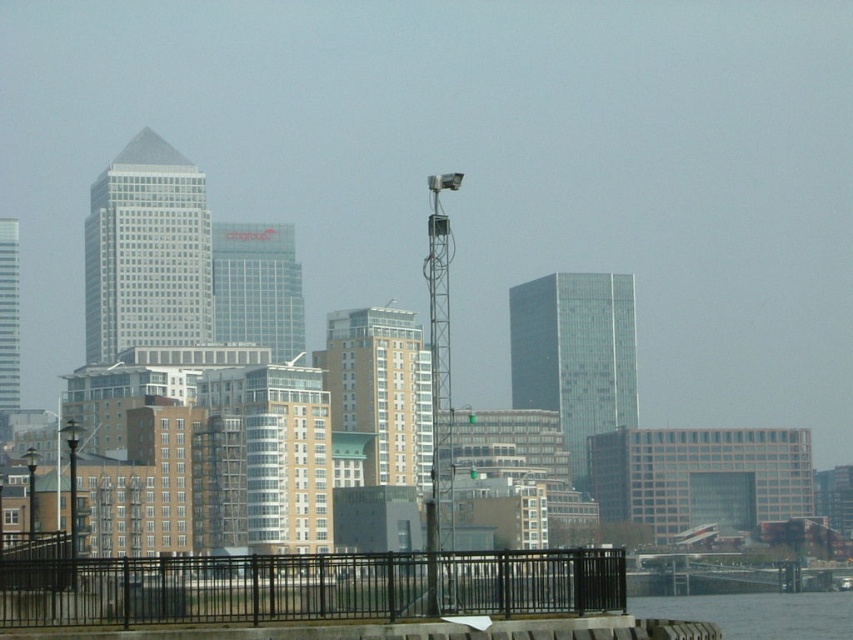
Question: Which point appears farthest from the camera in this image?

Choices:
 (A) (13, 365)
 (B) (525, 310)
 (C) (492, 554)
 (D) (361, 340)

Answer: (B)

Question: Which point is closer to the camera taking this photo?

Choices:
 (A) (161, 337)
 (B) (404, 604)
 (C) (378, 449)
 (D) (271, 230)

Answer: (B)

Question: Does white glass building at center appear under white glass skyscraper at center?

Choices:
 (A) no
 (B) yes

Answer: (B)

Question: Based on their relative distances, which object is nearer to the black metal fence at lower center?

Choices:
 (A) matte glass skyscraper at upper left
 (B) white glass building at center
 (C) white glass skyscraper at center

Answer: (B)

Question: Can you confirm if white glass building at center is positioned to the left of white glass skyscraper at center?

Choices:
 (A) no
 (B) yes

Answer: (A)

Question: Considering the relative positions of white glass building at center and white glass skyscraper at center in the image provided, where is white glass building at center located with respect to white glass skyscraper at center?

Choices:
 (A) below
 (B) above

Answer: (A)